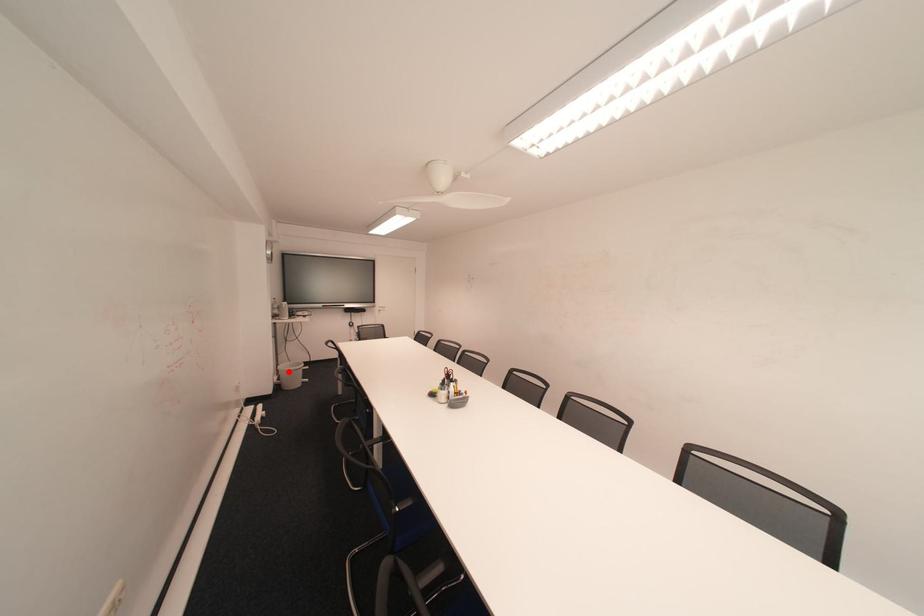
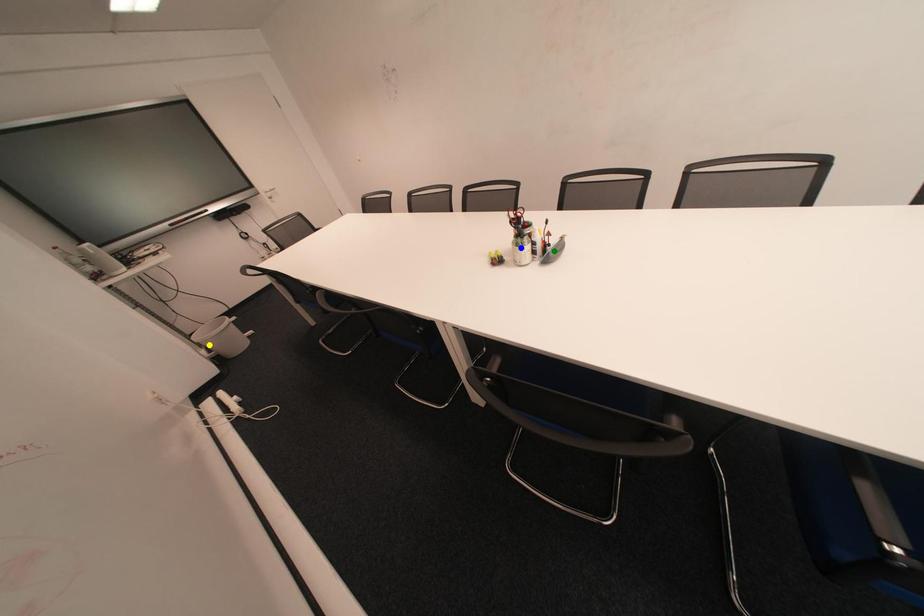
Question: I am providing you with two images of the same scene from different viewpoints. A red point is marked on the first image. You are given multiple points on the second image. Can you choose the point in image 2 that corresponds to the point in image 1?

Choices:
 (A) green point
 (B) blue point
 (C) yellow point

Answer: (C)